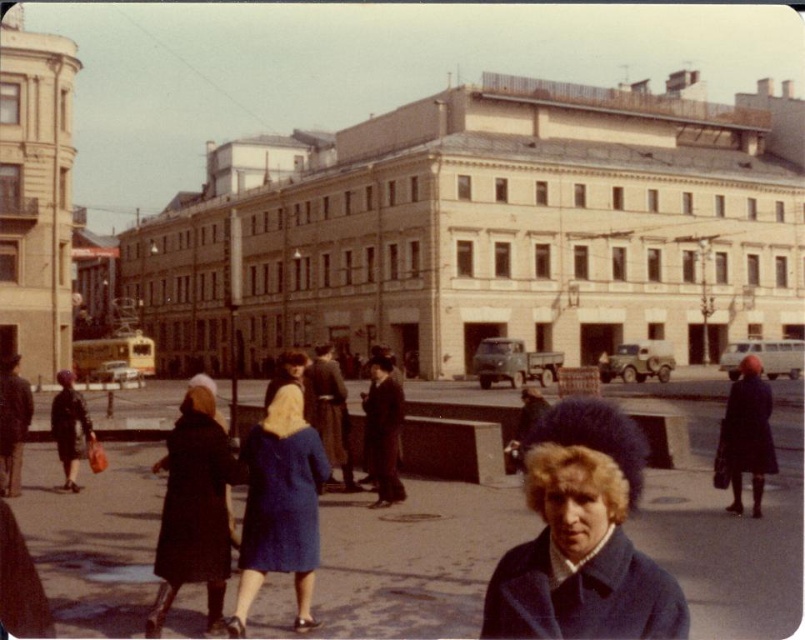
Question: Which object appears closest to the camera in this image?

Choices:
 (A) blue woolen coat at center
 (B) dark blue coat at center

Answer: (A)

Question: Does blue woolen coat at center appear over dark blue coat at center?

Choices:
 (A) no
 (B) yes

Answer: (B)

Question: Among these objects, which one is nearest to the camera?

Choices:
 (A) dark blue coat at center
 (B) blue woolen coat at center

Answer: (B)

Question: Is blue woolen coat at center further to camera compared to dark blue coat at center?

Choices:
 (A) no
 (B) yes

Answer: (A)

Question: Is blue woolen coat at center further to camera compared to dark blue coat at center?

Choices:
 (A) no
 (B) yes

Answer: (A)

Question: Which object appears closest to the camera in this image?

Choices:
 (A) blue woolen coat at center
 (B) dark blue coat at center

Answer: (A)